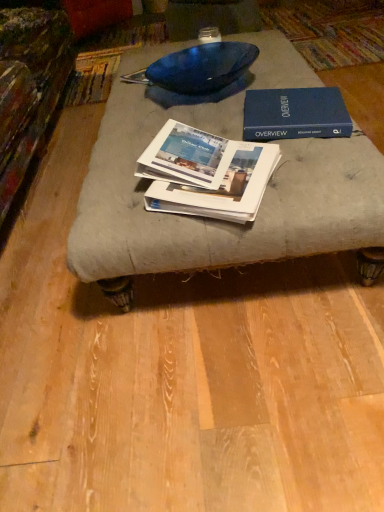
At what (x,y) coordinates should I click in order to perform the action: click on empty space that is ontop of white glossy book at center, the 1th book ordered from the bottom (from a real-world perspective). Please return your answer as a coordinate pair (x, y). Looking at the image, I should click on (216, 164).